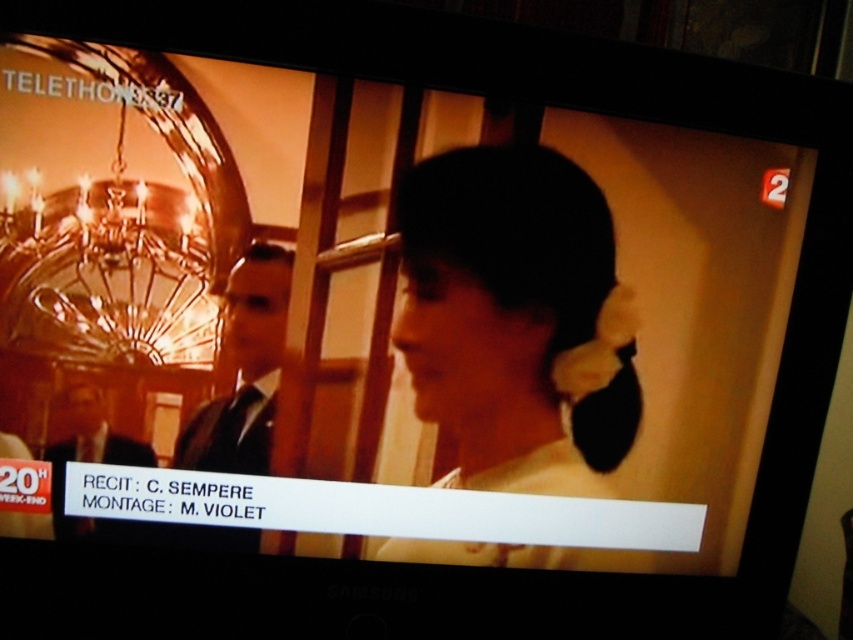
Question: Is smooth white hairband at center to the right of black suit at center from the viewer's perspective?

Choices:
 (A) yes
 (B) no

Answer: (A)

Question: Which object is the closest to the black suit at center?

Choices:
 (A) dark suit at lower left
 (B) smooth white hairband at center

Answer: (A)

Question: Which of the following is the farthest from the observer?

Choices:
 (A) (257, 396)
 (B) (97, 400)

Answer: (A)

Question: Which point appears closest to the camera in this image?

Choices:
 (A) (258, 410)
 (B) (119, 440)
 (C) (462, 544)

Answer: (B)

Question: Is the position of smooth white hairband at center more distant than that of dark suit at lower left?

Choices:
 (A) no
 (B) yes

Answer: (B)

Question: Considering the relative positions of smooth white hairband at center and black suit at center in the image provided, where is smooth white hairband at center located with respect to black suit at center?

Choices:
 (A) right
 (B) left

Answer: (A)